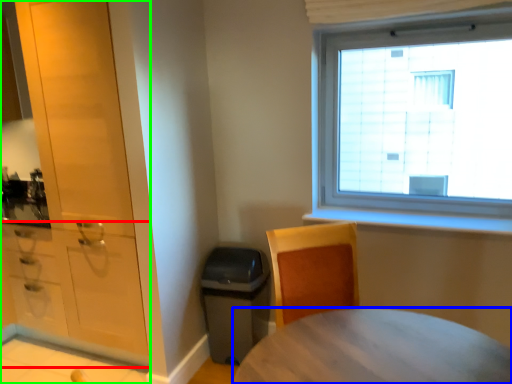
Question: Considering the real-world distances, which object is closest to cabinetry (highlighted by a red box)? desk (highlighted by a blue box) or cabinetry (highlighted by a green box).

Choices:
 (A) desk
 (B) cabinetry

Answer: (B)